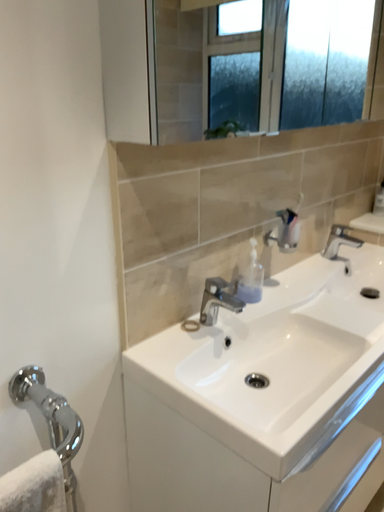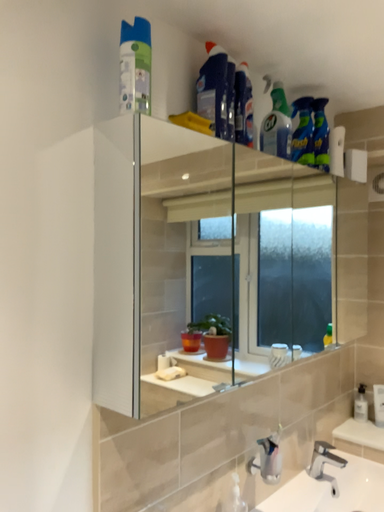
Question: Which way did the camera rotate in the video?

Choices:
 (A) rotated upward
 (B) rotated downward

Answer: (A)